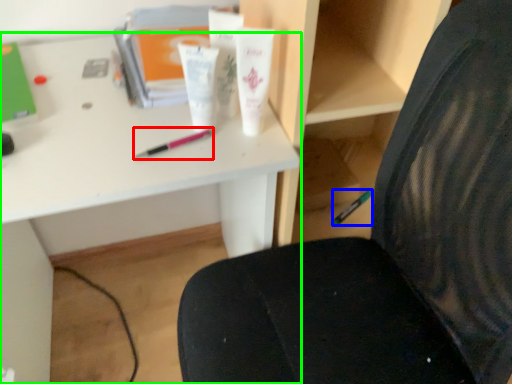
Question: Which object is the closest to the pencil (highlighted by a red box)? Choose among these: stationery (highlighted by a blue box) or desk (highlighted by a green box).

Choices:
 (A) stationery
 (B) desk

Answer: (B)